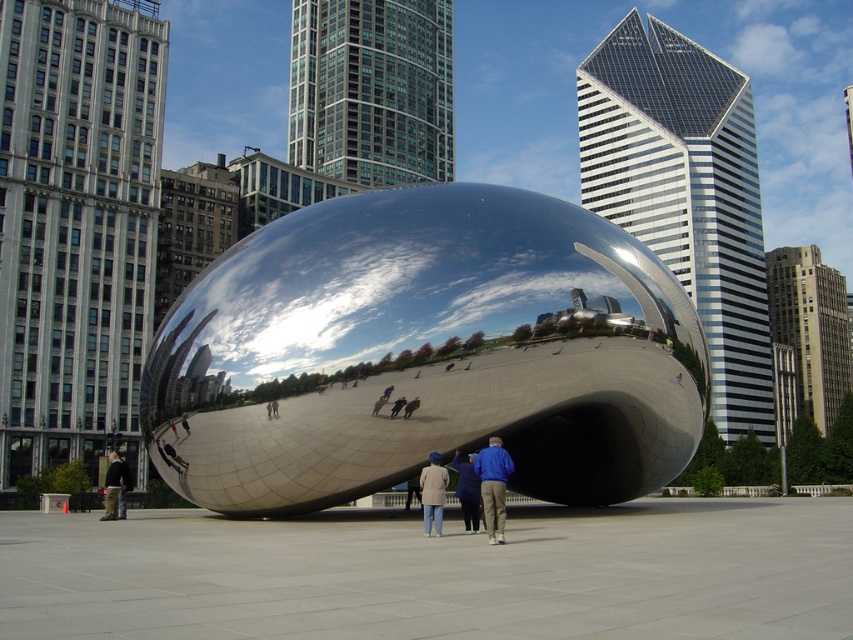
Can you confirm if blue denim jacket at center is smaller than dark gray jacket at lower left?

Correct, blue denim jacket at center occupies less space than dark gray jacket at lower left.

Measure the distance between blue denim jacket at center and dark gray jacket at lower left.

blue denim jacket at center and dark gray jacket at lower left are 18.44 meters apart.

Is point (468, 520) positioned behind point (106, 492)?

No, it is in front of (106, 492).

Locate an element on the screen. The image size is (853, 640). blue denim jacket at center is located at coordinates (486, 484).

In the scene shown: Can you confirm if blue fleece jacket at center is positioned to the left of blue denim jeans at center?

No, blue fleece jacket at center is not to the left of blue denim jeans at center.

What are the coordinates of `blue fleece jacket at center` in the screenshot? It's located at (492, 486).

Is point (482, 492) positioned before point (473, 499)?

Yes, it is in front of point (473, 499).

Find the location of a particular element. The image size is (853, 640). blue fleece jacket at center is located at coordinates (492, 486).

In the scene shown: Who is shorter, blue fleece jacket at center or beige wool coat at center?

beige wool coat at center

Which is in front, point (474, 465) or point (433, 496)?

Point (474, 465) is more forward.

Find the location of `blue fleece jacket at center`. blue fleece jacket at center is located at coordinates click(492, 486).